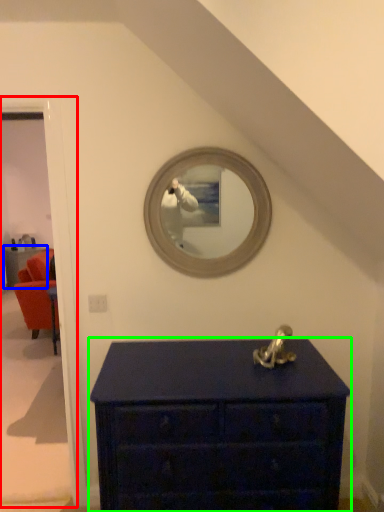
Question: Which object is the closest to the door (highlighted by a red box)? Choose among these: furniture (highlighted by a blue box) or chest of drawers (highlighted by a green box).

Choices:
 (A) furniture
 (B) chest of drawers

Answer: (B)